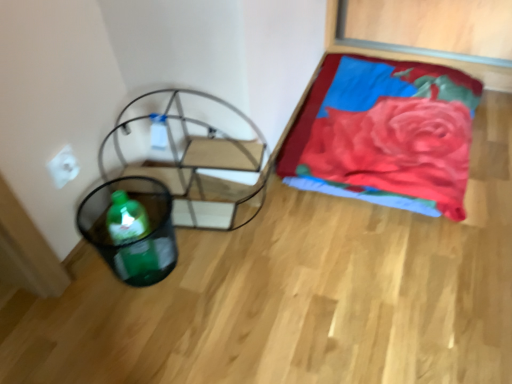
You are a GUI agent. You are given a task and a screenshot of the screen. Output one action in this format:
    pyautogui.click(x=<x>, y=<y>)
    Task: Click on the white matte electric outlet at upper left
    This screenshot has width=512, height=384.
    Given the screenshot: What is the action you would take?
    pyautogui.click(x=63, y=167)

The width and height of the screenshot is (512, 384). I want to click on green plastic basket at lower left, so click(131, 228).

Looking at this image, which object is closer to the camera taking this photo, white matte electric outlet at upper left or velvet red blanket at upper right?

white matte electric outlet at upper left is more forward.

Find the location of a particular element. electric outlet below the velvet red blanket at upper right (from the image's perspective) is located at coordinates (63, 167).

Which is closer, (64, 180) or (322, 71)?

Point (64, 180).

Looking at this image, is green plastic basket at lower left turned away from metallic frame swivel chair at left?

That's right, green plastic basket at lower left is facing away from metallic frame swivel chair at left.

Identify the location of swivel chair that is behind the green plastic basket at lower left. (199, 164).

From a real-world perspective, is green plastic basket at lower left below metallic frame swivel chair at left?

Yes, from a real-world perspective, green plastic basket at lower left is under metallic frame swivel chair at left.

Is green plastic basket at lower left situated inside metallic frame swivel chair at left or outside?

green plastic basket at lower left is not inside metallic frame swivel chair at left, it's outside.

How far apart are velvet red blanket at upper right and white matte electric outlet at upper left?

A distance of 38.89 inches exists between velvet red blanket at upper right and white matte electric outlet at upper left.

In the image, is velvet red blanket at upper right positioned in front of or behind white matte electric outlet at upper left?

velvet red blanket at upper right is positioned farther from the viewer than white matte electric outlet at upper left.

Is velvet red blanket at upper right looking in the opposite direction of white matte electric outlet at upper left?

No, velvet red blanket at upper right's orientation is not away from white matte electric outlet at upper left.

From a real-world perspective, who is located higher, velvet red blanket at upper right or white matte electric outlet at upper left?

In real-world perspective, white matte electric outlet at upper left is above.

Can you tell me how much metallic frame swivel chair at left and white matte electric outlet at upper left differ in facing direction?

They differ by 77.1 degrees in their facing directions.

From a real-world perspective, who is located higher, metallic frame swivel chair at left or white matte electric outlet at upper left?

white matte electric outlet at upper left, from a real-world perspective.

At what (x,y) coordinates should I click in order to perform the action: click on swivel chair below the white matte electric outlet at upper left (from a real-world perspective). Please return your answer as a coordinate pair (x, y). Looking at the image, I should click on (199, 164).

Is metallic frame swivel chair at left oriented towards white matte electric outlet at upper left?

No, metallic frame swivel chair at left is not facing towards white matte electric outlet at upper left.

Considering the relative sizes of green plastic basket at lower left and white matte electric outlet at upper left in the image provided, is green plastic basket at lower left taller than white matte electric outlet at upper left?

Indeed, green plastic basket at lower left has a greater height compared to white matte electric outlet at upper left.

Consider the image. Which object is further away from the camera, green plastic basket at lower left or white matte electric outlet at upper left?

white matte electric outlet at upper left is further from the camera.

Locate an element on the screen. The width and height of the screenshot is (512, 384). basket on the right of white matte electric outlet at upper left is located at coordinates (131, 228).

Considering the relative sizes of green plastic basket at lower left and white matte electric outlet at upper left in the image provided, is green plastic basket at lower left wider than white matte electric outlet at upper left?

Yes, green plastic basket at lower left is wider than white matte electric outlet at upper left.

Looking at the image, does green plastic basket at lower left seem bigger or smaller compared to velvet red blanket at upper right?

Clearly, green plastic basket at lower left is smaller in size than velvet red blanket at upper right.

In order to click on blanket on the right of green plastic basket at lower left in this screenshot , I will do `click(385, 134)`.

Is green plastic basket at lower left in front of or behind velvet red blanket at upper right in the image?

Visually, green plastic basket at lower left is located in front of velvet red blanket at upper right.

From a real-world perspective, is white matte electric outlet at upper left on top of metallic frame swivel chair at left?

Yes, from a real-world perspective, white matte electric outlet at upper left is over metallic frame swivel chair at left

Who is more distant, white matte electric outlet at upper left or metallic frame swivel chair at left?

white matte electric outlet at upper left.

Which is behind, point (68, 178) or point (197, 205)?

The point (197, 205) is farther from the camera.

Choose the correct answer: Is white matte electric outlet at upper left inside metallic frame swivel chair at left or outside it?

The correct answer is: outside.

Find the location of a particular element. Image resolution: width=512 pixels, height=384 pixels. blanket behind the white matte electric outlet at upper left is located at coordinates (385, 134).

Image resolution: width=512 pixels, height=384 pixels. Find the location of `swivel chair that appears above the green plastic basket at lower left (from the image's perspective)`. swivel chair that appears above the green plastic basket at lower left (from the image's perspective) is located at coordinates (199, 164).

When comparing their distances from white matte electric outlet at upper left, does green plastic basket at lower left or velvet red blanket at upper right seem further?

velvet red blanket at upper right is positioned further to the anchor white matte electric outlet at upper left.

Based on their spatial positions, is metallic frame swivel chair at left or white matte electric outlet at upper left closer to velvet red blanket at upper right?

metallic frame swivel chair at left.

When comparing their distances from white matte electric outlet at upper left, does green plastic basket at lower left or metallic frame swivel chair at left seem further?

Among the two, metallic frame swivel chair at left is located further to white matte electric outlet at upper left.

When comparing their distances from metallic frame swivel chair at left, does velvet red blanket at upper right or green plastic basket at lower left seem closer?

The object closer to metallic frame swivel chair at left is green plastic basket at lower left.

Based on their spatial positions, is green plastic basket at lower left or white matte electric outlet at upper left closer to metallic frame swivel chair at left?

Based on the image, green plastic basket at lower left appears to be nearer to metallic frame swivel chair at left.

Which object lies nearer to the anchor point metallic frame swivel chair at left, green plastic basket at lower left or velvet red blanket at upper right?

Among the two, green plastic basket at lower left is located nearer to metallic frame swivel chair at left.

When comparing their distances from velvet red blanket at upper right, does metallic frame swivel chair at left or green plastic basket at lower left seem further?

green plastic basket at lower left.

Consider the image. Based on their spatial positions, is white matte electric outlet at upper left or velvet red blanket at upper right closer to metallic frame swivel chair at left?

Among the two, white matte electric outlet at upper left is located nearer to metallic frame swivel chair at left.

In order to click on basket located between white matte electric outlet at upper left and metallic frame swivel chair at left in the left-right direction in this screenshot , I will do `click(131, 228)`.

Locate an element on the screen. The image size is (512, 384). swivel chair between green plastic basket at lower left and velvet red blanket at upper right in the horizontal direction is located at coordinates (199, 164).

Locate an element on the screen. This screenshot has width=512, height=384. swivel chair between white matte electric outlet at upper left and velvet red blanket at upper right in the horizontal direction is located at coordinates (199, 164).

Locate an element on the screen. This screenshot has width=512, height=384. basket located between white matte electric outlet at upper left and velvet red blanket at upper right in the left-right direction is located at coordinates (131, 228).